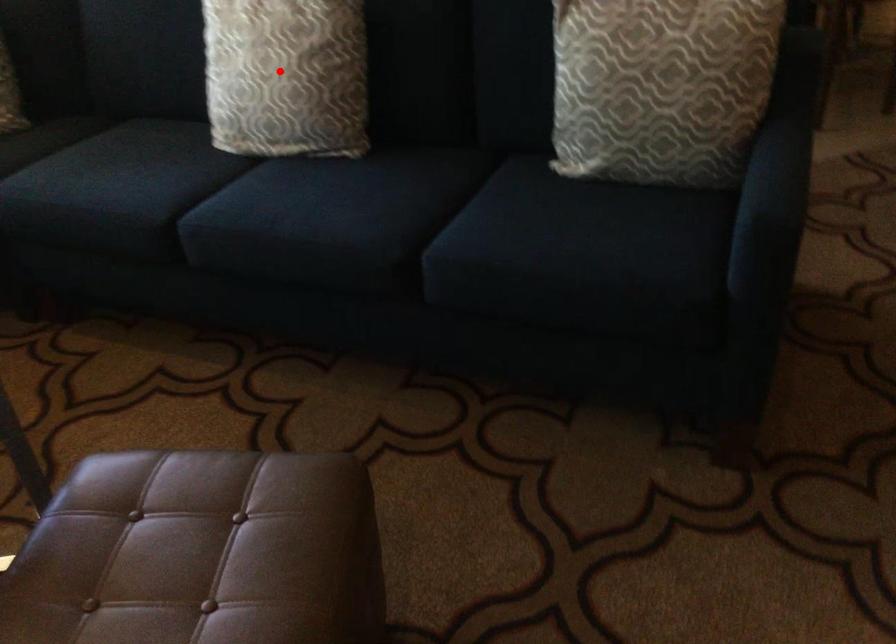
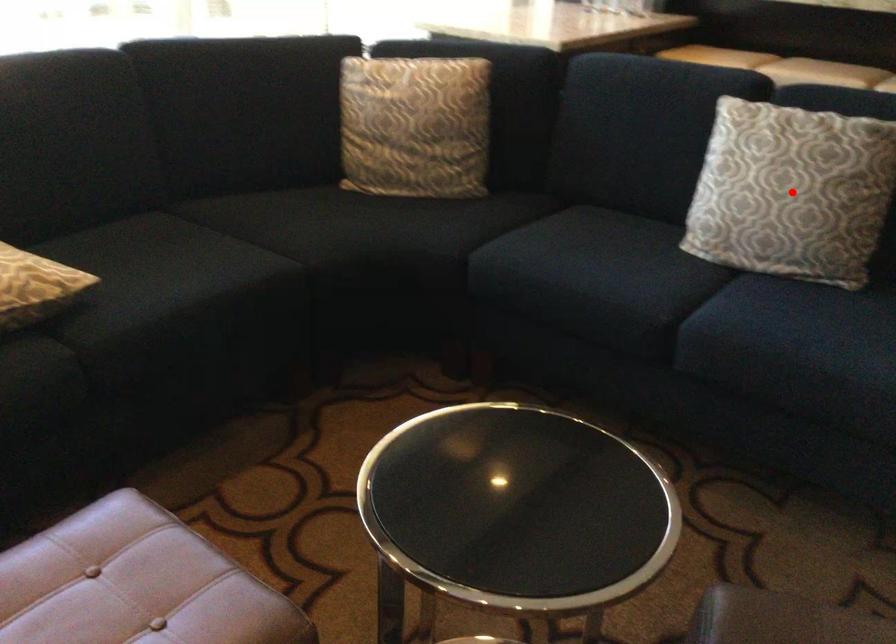
I am providing you with two images of the same scene from different viewpoints. A red point is marked on the first image and another point is marked on the second image. Does the point marked in image1 correspond to the same location as the one in image2?

Yes